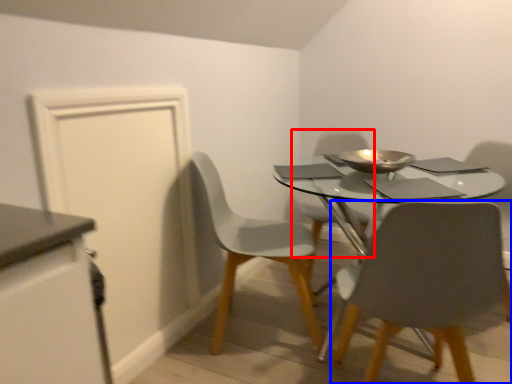
Question: Which object is closer to the camera taking this photo, chair (highlighted by a red box) or chair (highlighted by a blue box)?

Choices:
 (A) chair
 (B) chair

Answer: (B)